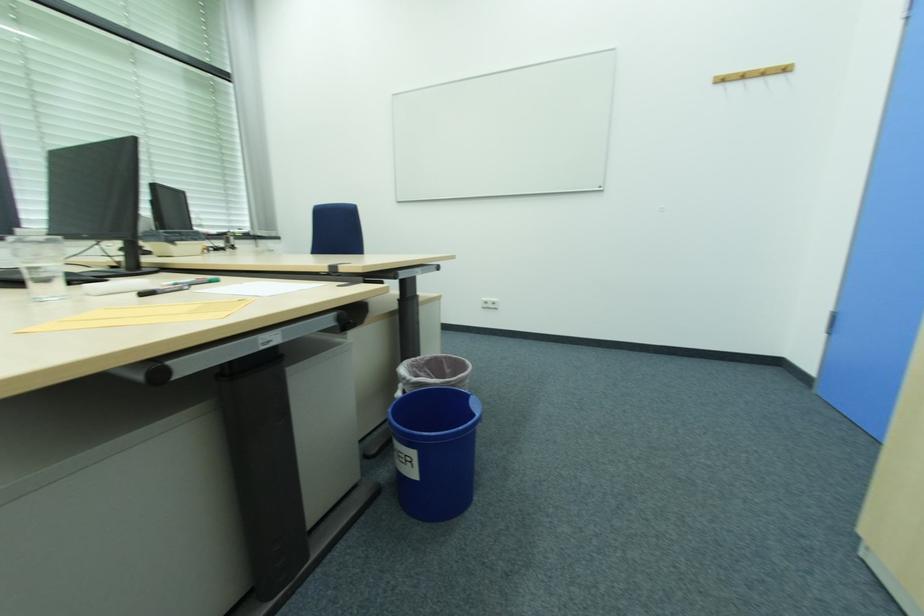
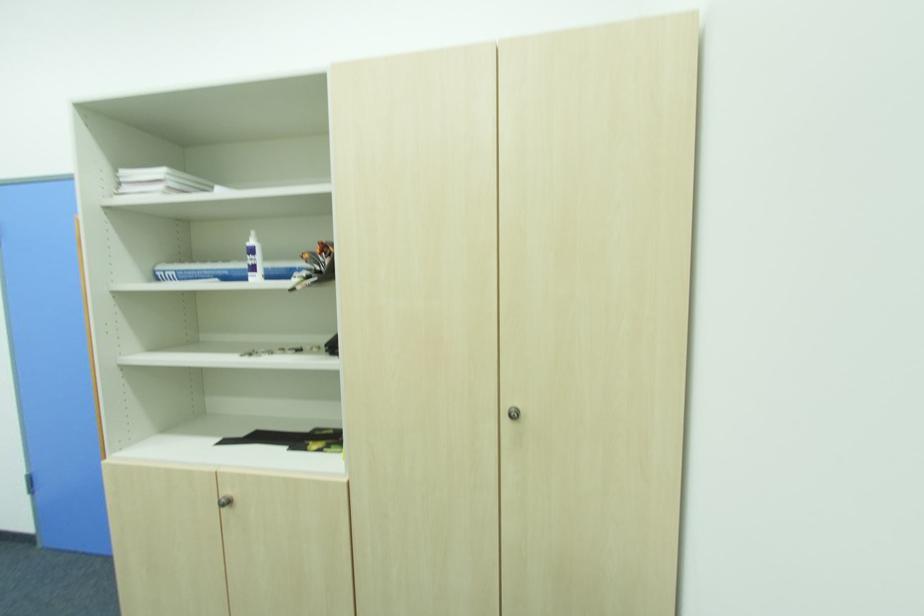
Question: The first image is from the beginning of the video and the second image is from the end. How did the camera likely rotate when shooting the video?

Choices:
 (A) Left
 (B) Right
 (C) Up
 (D) Down

Answer: (B)